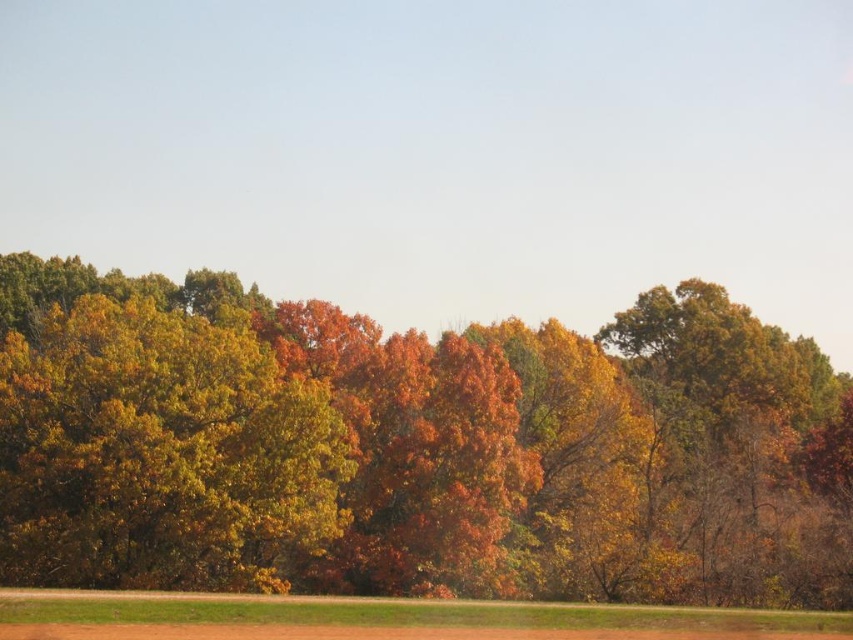
Question: Among these points, which one is farthest from the camera?

Choices:
 (A) (503, 572)
 (B) (172, 400)

Answer: (A)

Question: Does autumn foliage at center have a greater width compared to golden textured leaves at left?

Choices:
 (A) yes
 (B) no

Answer: (A)

Question: Is autumn foliage at center positioned at the back of golden textured leaves at left?

Choices:
 (A) no
 (B) yes

Answer: (B)

Question: Is autumn foliage at center smaller than golden textured leaves at left?

Choices:
 (A) yes
 (B) no

Answer: (B)

Question: Which of the following is the farthest from the observer?

Choices:
 (A) (241, 449)
 (B) (256, 516)

Answer: (A)